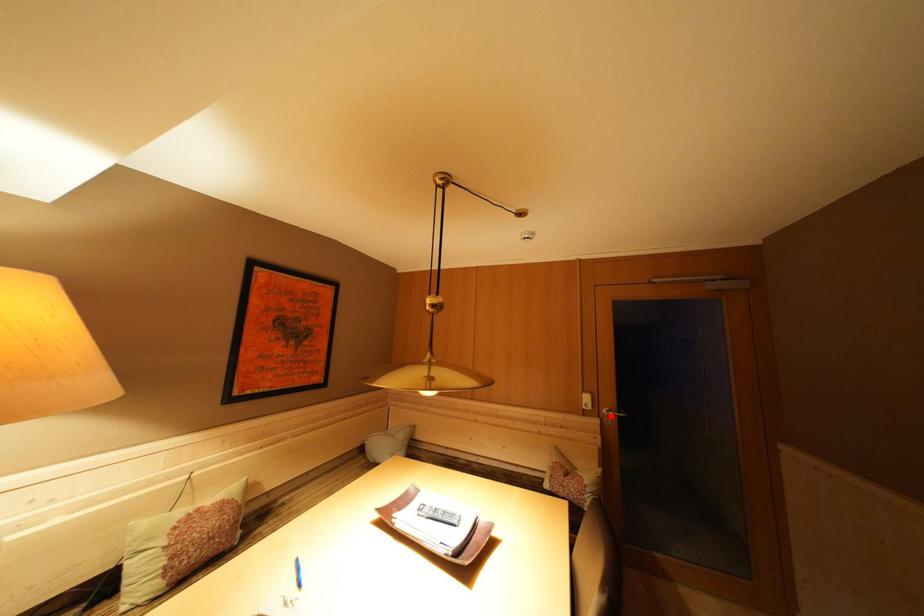
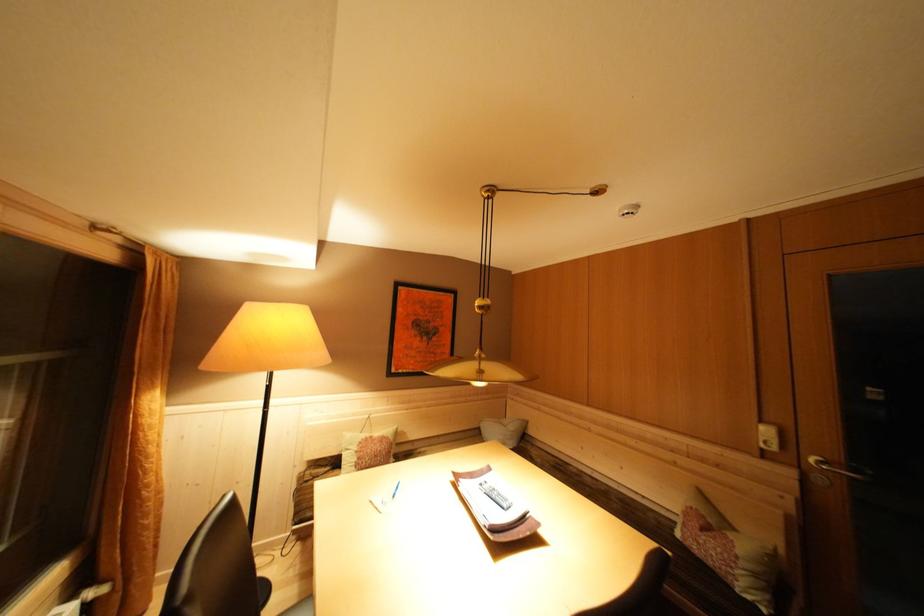
Find the pixel in the second image that matches the highlighted location in the first image.

(819, 466)